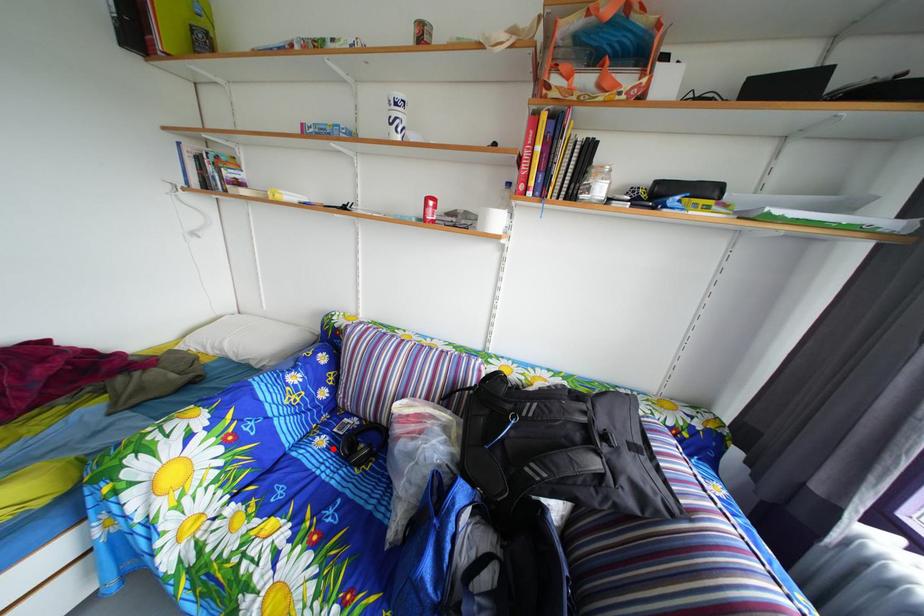
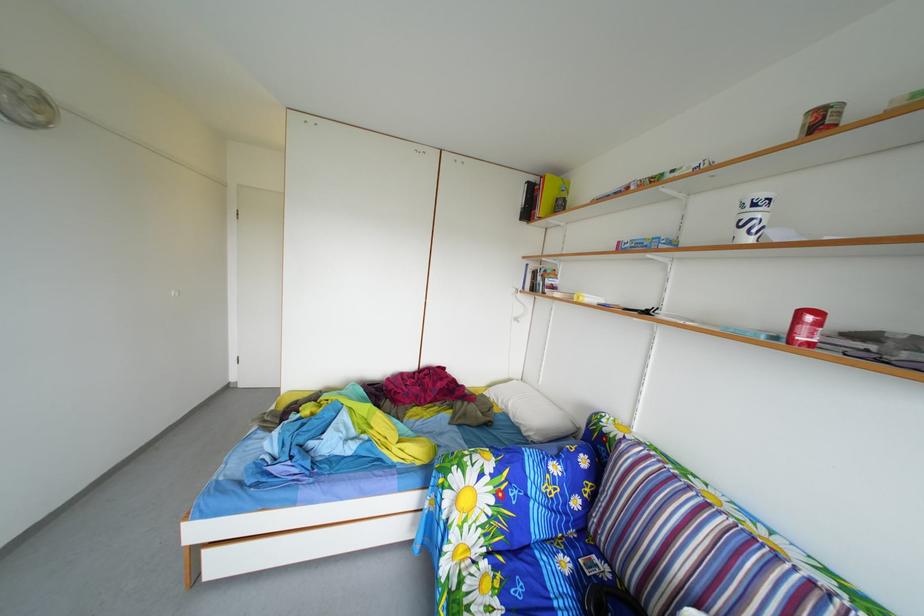
The point at the highlighted location is marked in the first image. Where is the corresponding point in the second image?

(576, 570)